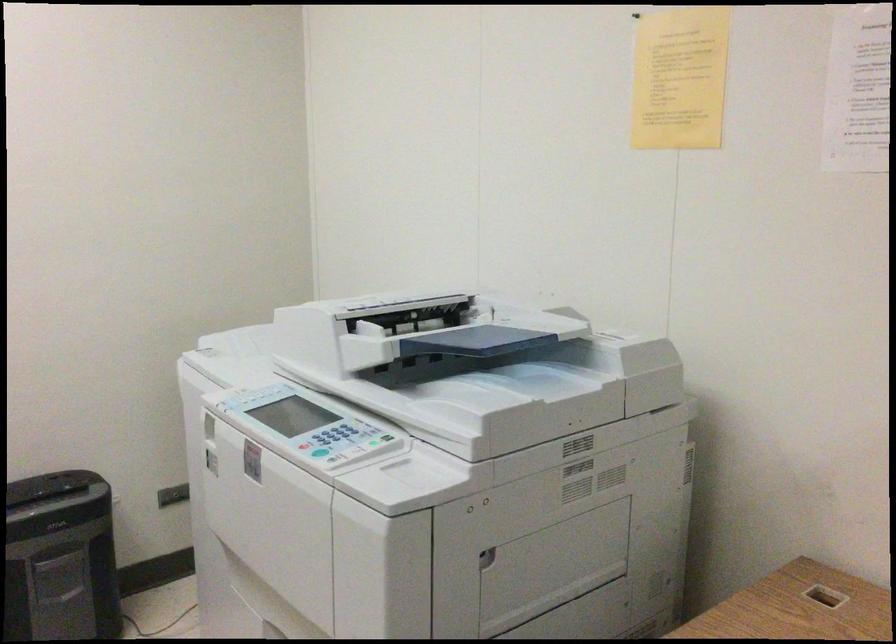
Where would you slid the blue paper guide? Please return your answer as a coordinate pair (x, y).

(492, 339)